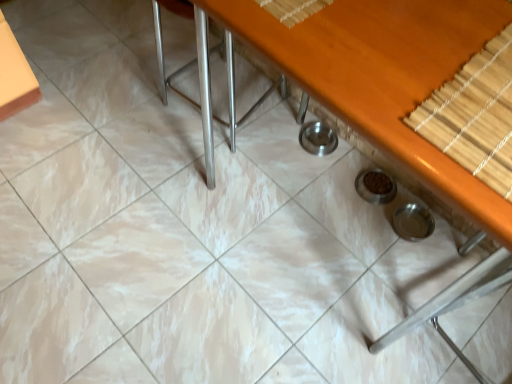
In order to click on free point below satin silver chair at center (from a real-world perspective) in this screenshot , I will do click(x=215, y=112).